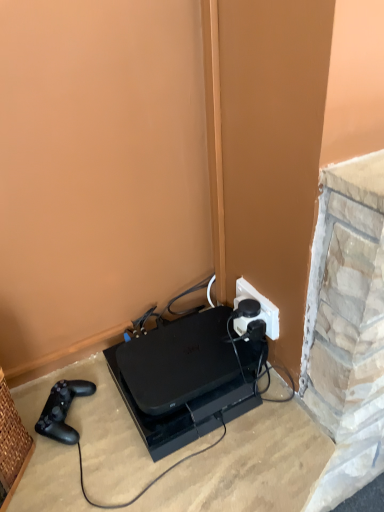
You are a GUI agent. You are given a task and a screenshot of the screen. Output one action in this format:
    pyautogui.click(x=<x>, y=<y>)
    Task: Click on the vacant space to the right of black matte game controller at lower left
    This screenshot has width=384, height=512.
    Given the screenshot: What is the action you would take?
    pyautogui.click(x=125, y=430)